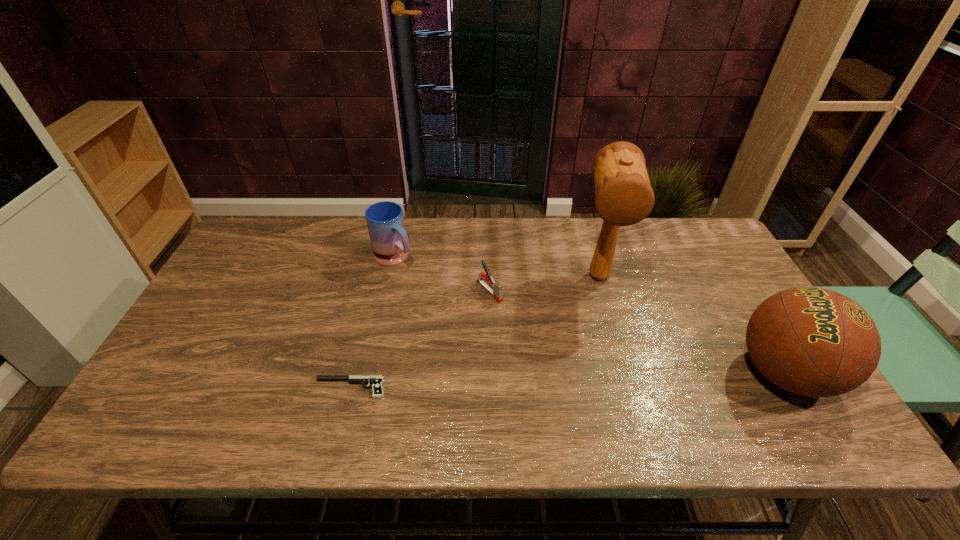
This screenshot has height=540, width=960. Find the location of `free space between the second shortest object and the mallet`. free space between the second shortest object and the mallet is located at coordinates (544, 284).

This screenshot has height=540, width=960. Identify the location of vacant space that's between the mallet and the third object from left to right. (544, 284).

This screenshot has height=540, width=960. Identify the location of vacant space in between the third object from left to right and the shortest object. (420, 340).

Where is `free point between the stapler and the pistol`? free point between the stapler and the pistol is located at coordinates point(420,340).

Choose which object is the second nearest neighbor to the third tallest object. Please provide its 2D coordinates. Your answer should be formatted as a tuple, i.e. [(x, y)], where the tuple contains the x and y coordinates of a point satisfying the conditions above.

[(376, 380)]

Image resolution: width=960 pixels, height=540 pixels. What are the coordinates of `object that is the second closest one to the mug` in the screenshot? It's located at (376, 380).